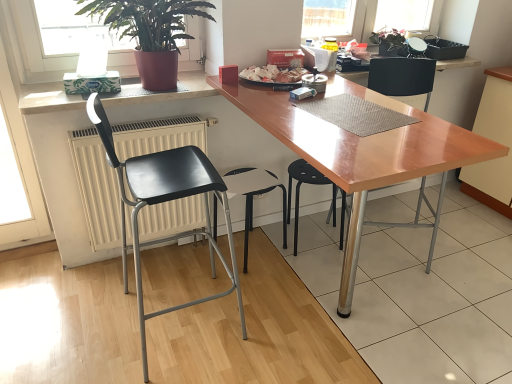
The image size is (512, 384). Find the location of `vacant region in front of black plastic stool at center, placed as the second chair when sorted from right to left`. vacant region in front of black plastic stool at center, placed as the second chair when sorted from right to left is located at coordinates (315, 276).